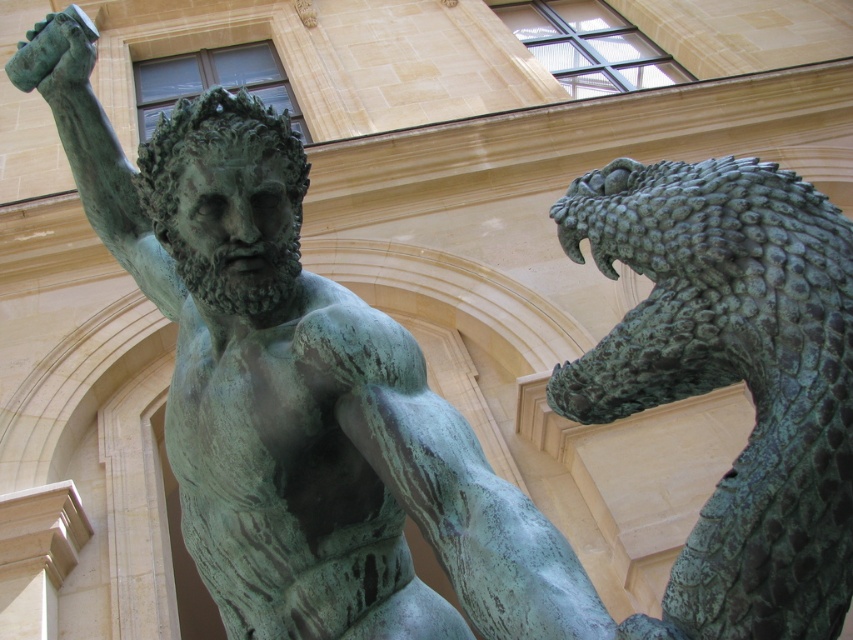
Between point (119, 205) and point (685, 611), which one is positioned in front?

Point (685, 611)

Is point (459, 536) positioned in front of point (756, 240)?

No, (459, 536) is behind (756, 240).

What do you see at coordinates (297, 394) in the screenshot?
I see `green patina statue at center` at bounding box center [297, 394].

Locate an element on the screen. Image resolution: width=853 pixels, height=640 pixels. green patina statue at center is located at coordinates (297, 394).